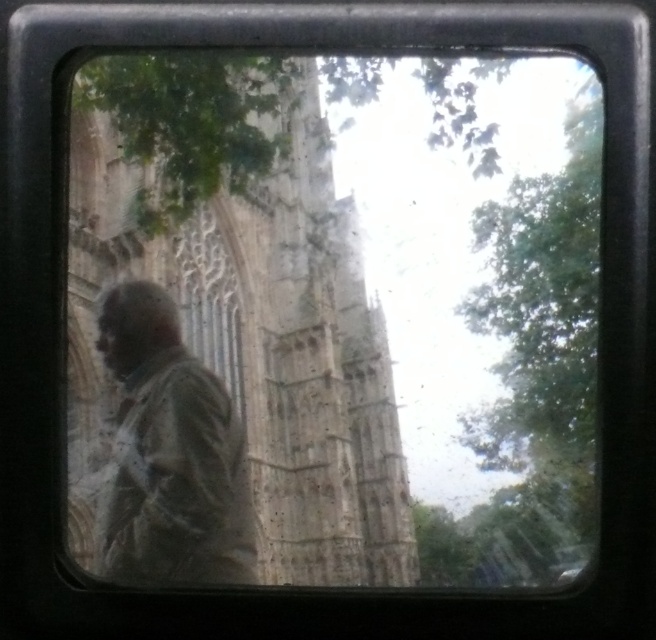
Based on the photo, between transparent glass window at center and distressed brown jacket at left, which one is positioned higher?

transparent glass window at center is higher up.

Which is below, transparent glass window at center or distressed brown jacket at left?

Positioned lower is distressed brown jacket at left.

Does point (405, 538) come in front of point (236, 426)?

No.

In order to click on transparent glass window at center in this screenshot , I will do `click(335, 317)`.